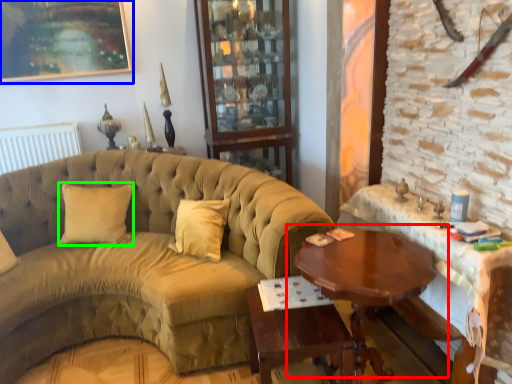
Question: Estimate the real-world distances between objects in this image. Which object is farther from table (highlighted by a red box), picture frame (highlighted by a blue box) or pillow (highlighted by a green box)?

Choices:
 (A) picture frame
 (B) pillow

Answer: (A)